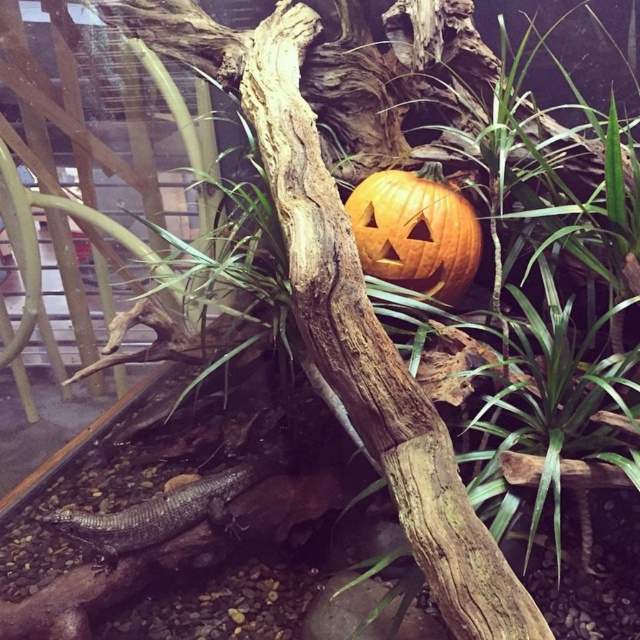
Who is shorter, orange matte pumpkin at center or shiny dark gray lizard at lower left?

With less height is shiny dark gray lizard at lower left.

Can you confirm if orange matte pumpkin at center is positioned below shiny dark gray lizard at lower left?

No, orange matte pumpkin at center is not below shiny dark gray lizard at lower left.

The width and height of the screenshot is (640, 640). I want to click on orange matte pumpkin at center, so tap(416, 230).